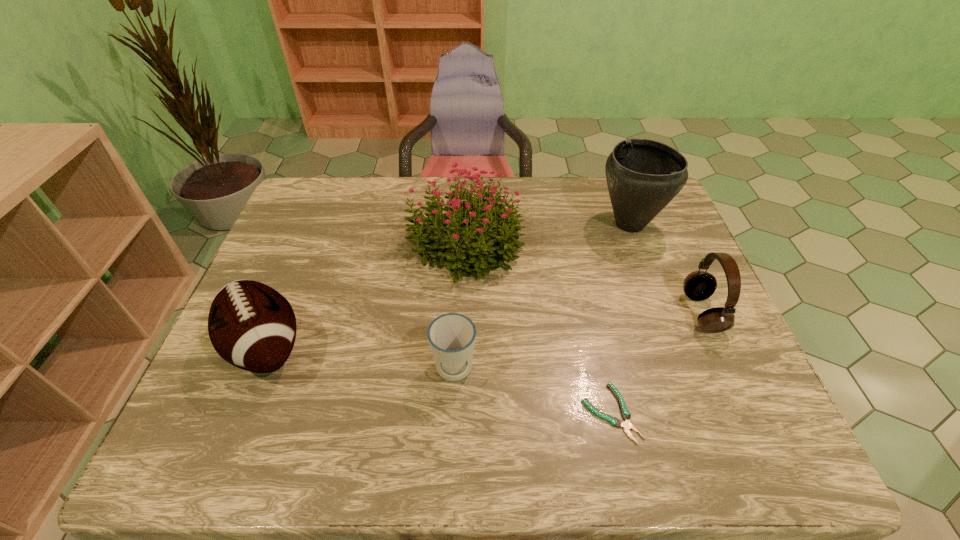
Image resolution: width=960 pixels, height=540 pixels. Identify the location of headset located in the right edge section of the desktop. (699, 285).

The image size is (960, 540). What are the coordinates of `object at the far right corner` in the screenshot? It's located at (643, 176).

Find the location of a particular element. vacant position at the far edge of the desktop is located at coordinates (399, 210).

In the image, there is a desktop. Identify the location of free space at the near edge. The width and height of the screenshot is (960, 540). (284, 434).

Identify the location of free space at the left edge. (283, 286).

In the image, there is a desktop. At what (x,y) coordinates should I click in order to perform the action: click on vacant space at the right edge. Please return your answer as a coordinate pair (x, y). Looking at the image, I should click on (716, 347).

Identify the location of free space at the far left corner of the desktop. click(x=307, y=213).

Where is `vacant space at the near left corner`? vacant space at the near left corner is located at coordinates (194, 443).

Find the location of a particular element. This screenshot has width=960, height=540. free space between the cup and the shortest object is located at coordinates (532, 392).

You are a GUI agent. You are given a task and a screenshot of the screen. Output one action in this format:
    pyautogui.click(x=<x>, y=<y>)
    Task: Click on the free space between the leftmost object and the cup
    This screenshot has height=540, width=960.
    Given the screenshot: What is the action you would take?
    pyautogui.click(x=360, y=359)